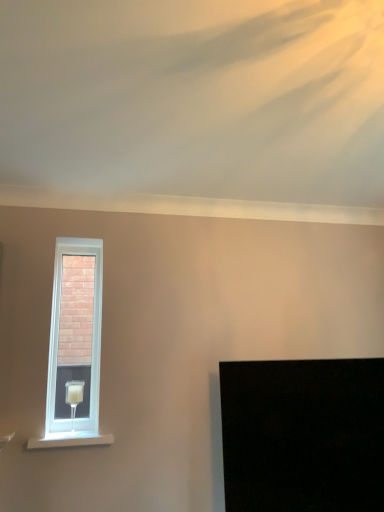
Question: Can you confirm if white plastic window at upper left is positioned to the left of black glossy screen at lower right?

Choices:
 (A) no
 (B) yes

Answer: (B)

Question: Is white plastic window at upper left not close to black glossy screen at lower right?

Choices:
 (A) yes
 (B) no

Answer: (A)

Question: From a real-world perspective, is white plastic window at upper left located beneath black glossy screen at lower right?

Choices:
 (A) yes
 (B) no

Answer: (B)

Question: From the image's perspective, does white plastic window at upper left appear higher than black glossy screen at lower right?

Choices:
 (A) yes
 (B) no

Answer: (A)

Question: Can you confirm if white plastic window at upper left is bigger than black glossy screen at lower right?

Choices:
 (A) no
 (B) yes

Answer: (A)

Question: Is white plastic window at upper left turned away from black glossy screen at lower right?

Choices:
 (A) yes
 (B) no

Answer: (B)

Question: Can you confirm if translucent glass table lamp at left is bigger than white plastic window at upper left?

Choices:
 (A) yes
 (B) no

Answer: (B)

Question: Is translucent glass table lamp at left closer to the viewer compared to white plastic window at upper left?

Choices:
 (A) no
 (B) yes

Answer: (B)

Question: From a real-world perspective, is translucent glass table lamp at left positioned over white plastic window at upper left based on gravity?

Choices:
 (A) no
 (B) yes

Answer: (A)

Question: Does translucent glass table lamp at left contain white plastic window at upper left?

Choices:
 (A) no
 (B) yes

Answer: (A)

Question: Can you confirm if translucent glass table lamp at left is positioned to the right of white plastic window at upper left?

Choices:
 (A) yes
 (B) no

Answer: (A)

Question: From a real-world perspective, does translucent glass table lamp at left sit lower than white plastic window at upper left?

Choices:
 (A) yes
 (B) no

Answer: (A)

Question: Is white plastic window at upper left aimed at white painted wood at lower left?

Choices:
 (A) no
 (B) yes

Answer: (B)